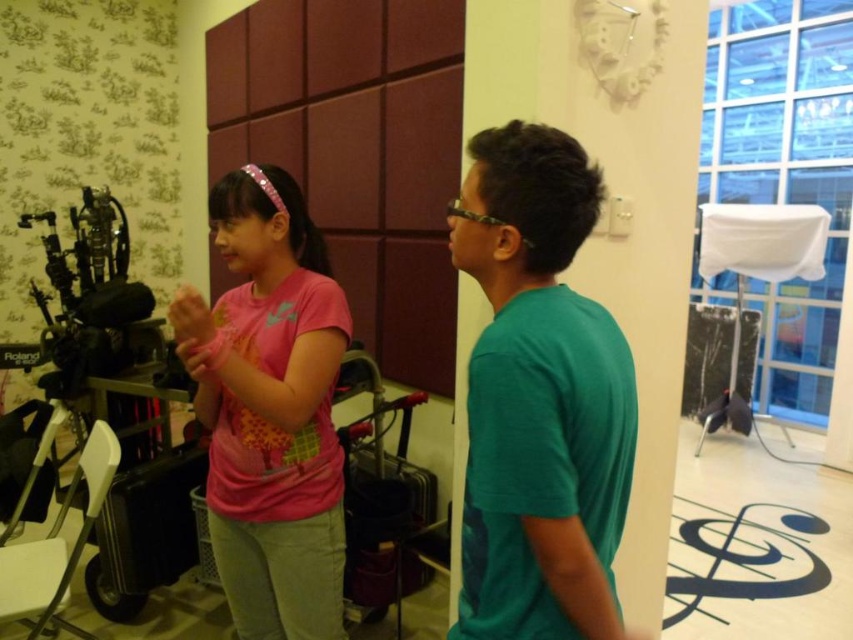
Does teal matte t-shirt at center appear on the left side of pink matte shirt at center?

No, teal matte t-shirt at center is not to the left of pink matte shirt at center.

Between teal matte t-shirt at center and pink matte shirt at center, which one is positioned lower?

Positioned lower is pink matte shirt at center.

Is point (496, 380) in front of point (279, 412)?

Yes, it is.

This screenshot has height=640, width=853. In order to click on teal matte t-shirt at center in this screenshot , I will do `click(538, 397)`.